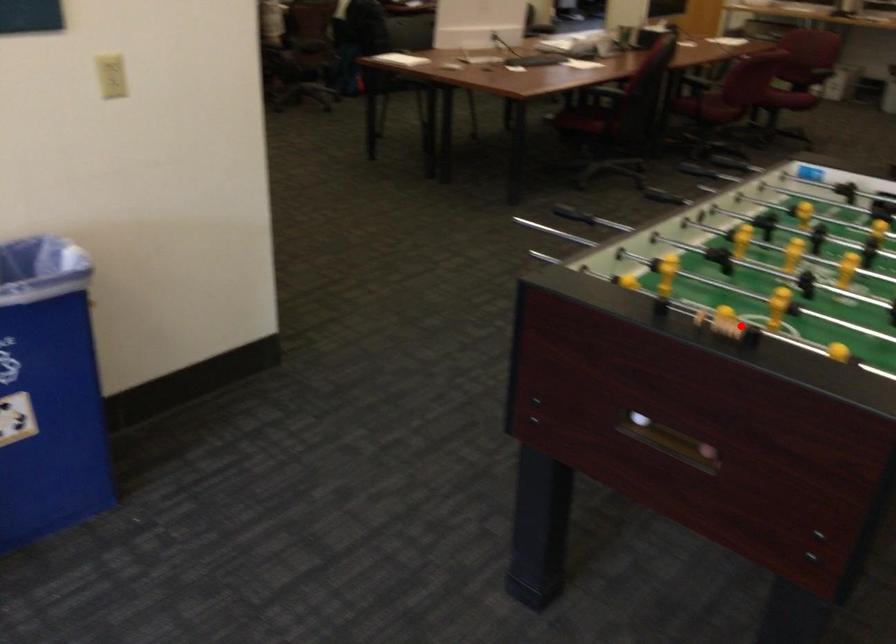
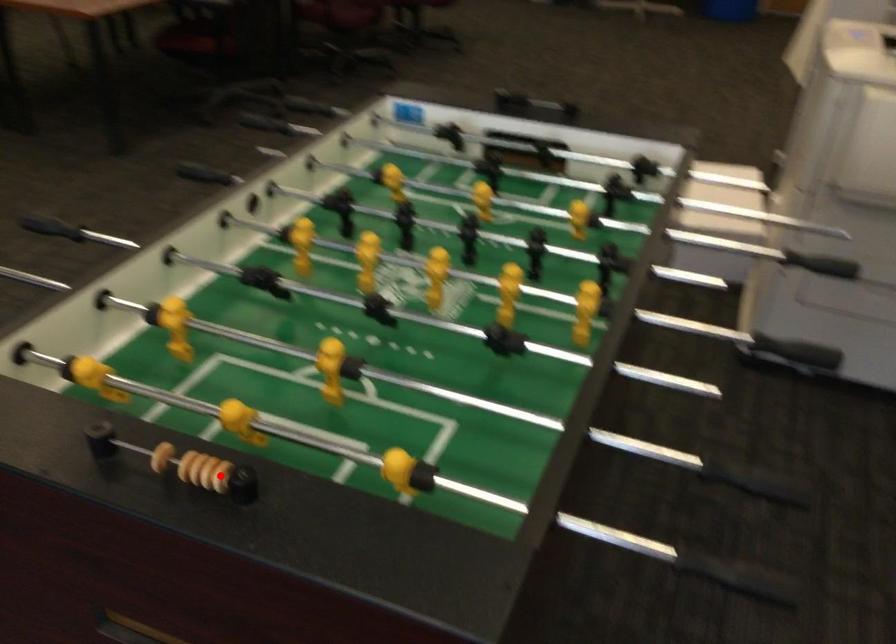
I am providing you with two images of the same scene from different viewpoints. A red point is marked on the first image and another point is marked on the second image. Does the point marked in image1 correspond to the same location as the one in image2?

Yes